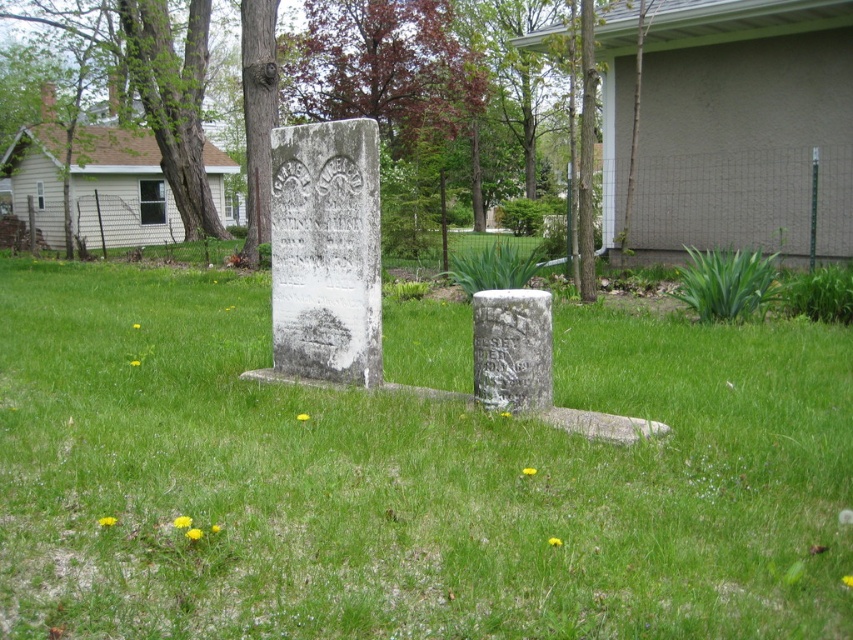
You are a gardener holding a 1.5 meter long gardening tool. You need to reach the white stone gravestone at center from your current position near the green grass at center. Can you reach it without moving your feet?

The green grass at center is 1.82 meters away from the white stone gravestone at center. Since your tool is only 1.5 meters long, you cannot reach the white stone gravestone at center without moving closer.

You are standing in the middle of the grassy area and want to take a photo of the white stone gravestone at center. To avoid having the green rough bark tree at upper left in the background, which direction should you move?

Move to the right side of the white stone gravestone at center so that the green rough bark tree at upper left is no longer in the background.

You are standing in the middle of the green grass at center and want to look up at the green rough bark tree at upper left. Which direction should you face to see the tree?

The green grass at center is located below green rough bark tree at upper left, so you should look upward and towards the upper left direction to see the tree.